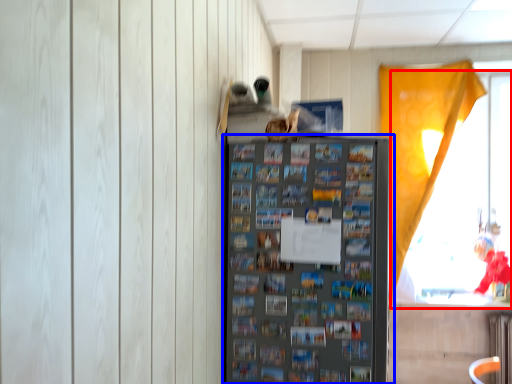
Question: Which point is further to the camera, window (highlighted by a red box) or shelf (highlighted by a blue box)?

Choices:
 (A) window
 (B) shelf

Answer: (A)